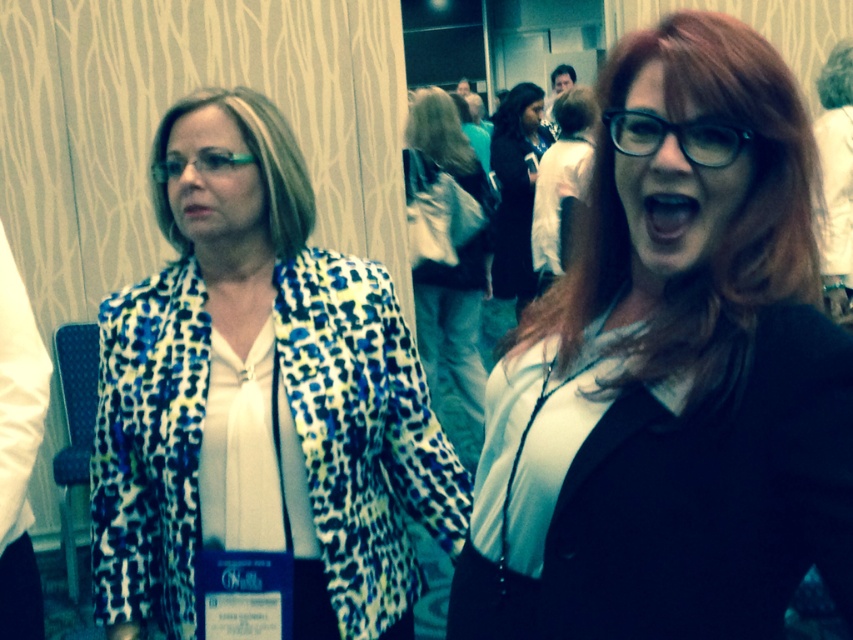
You are organizing a photo shoot and need to place a large backdrop behind the leopard print blazer at center and the green plastic glasses at upper left. Which object requires more horizontal space for the backdrop to fit properly?

The leopard print blazer at center requires more horizontal space because it might be wider than the green plastic glasses at upper left.

You are a photographer trying to capture a candid shot of the two women at the event. You want to focus on the point at coordinates point (792, 240). Given that your camera has a depth of field that can clearly capture objects within 35 inches from the lens, will the point be in focus?

The distance of point (792, 240) from the camera is 37.04 inches, which is slightly beyond the camera lens depth of field of 35 inches. Therefore, the point will not be in focus.